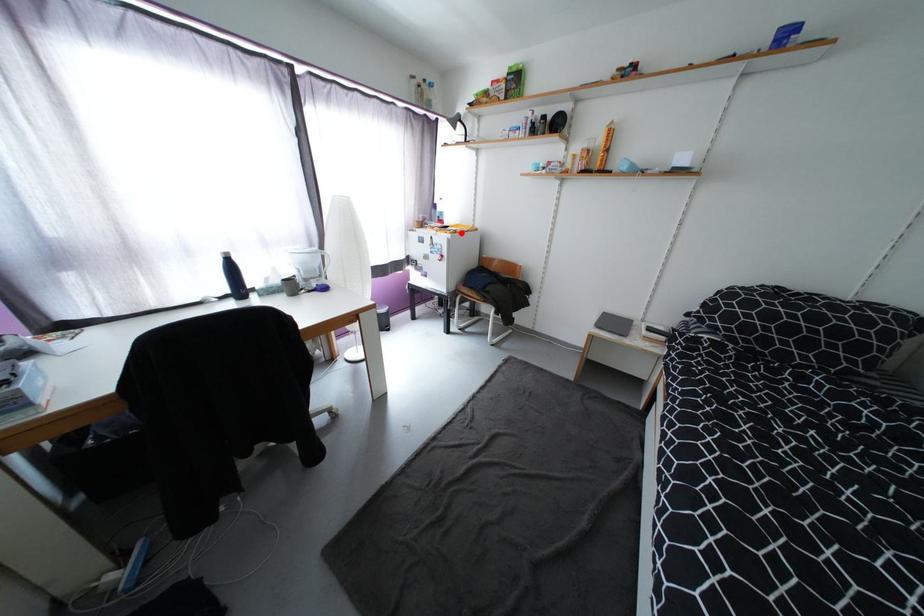
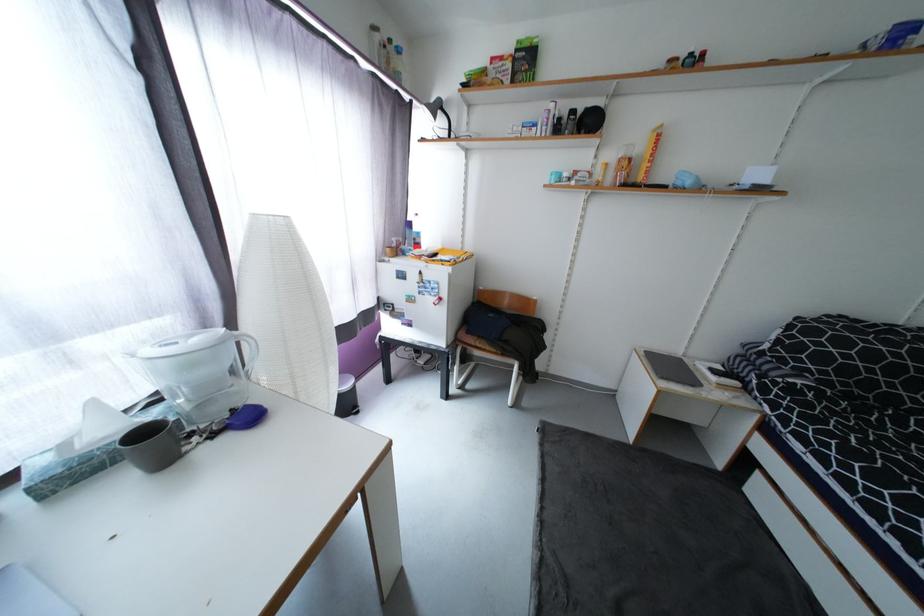
The point at the highlighted location is marked in the first image. Where is the corresponding point in the second image?

(460, 264)